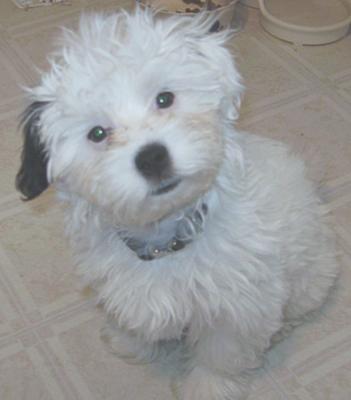
Image resolution: width=351 pixels, height=400 pixels. I want to click on water bowl, so click(x=310, y=28).